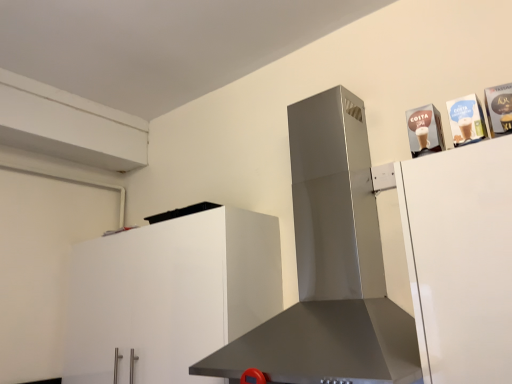
Question: From a real-world perspective, is white matte cabinet at lower left physically located above or below satin silver range hood at center?

Choices:
 (A) below
 (B) above

Answer: (A)

Question: Looking at the image, does white matte cabinet at lower left seem bigger or smaller compared to satin silver range hood at center?

Choices:
 (A) small
 (B) big

Answer: (A)

Question: Is point (112, 251) closer or farther from the camera than point (353, 235)?

Choices:
 (A) closer
 (B) farther

Answer: (B)

Question: Is satin silver range hood at center to the left or to the right of white matte cabinet at lower left in the image?

Choices:
 (A) right
 (B) left

Answer: (A)

Question: Is satin silver range hood at center in front of or behind white matte cabinet at lower left in the image?

Choices:
 (A) front
 (B) behind

Answer: (A)

Question: Considering the positions of satin silver range hood at center and white matte cabinet at lower left in the image, is satin silver range hood at center taller or shorter than white matte cabinet at lower left?

Choices:
 (A) tall
 (B) short

Answer: (A)

Question: Considering the positions of satin silver range hood at center and white matte cabinet at lower left in the image, is satin silver range hood at center wider or thinner than white matte cabinet at lower left?

Choices:
 (A) thin
 (B) wide

Answer: (B)